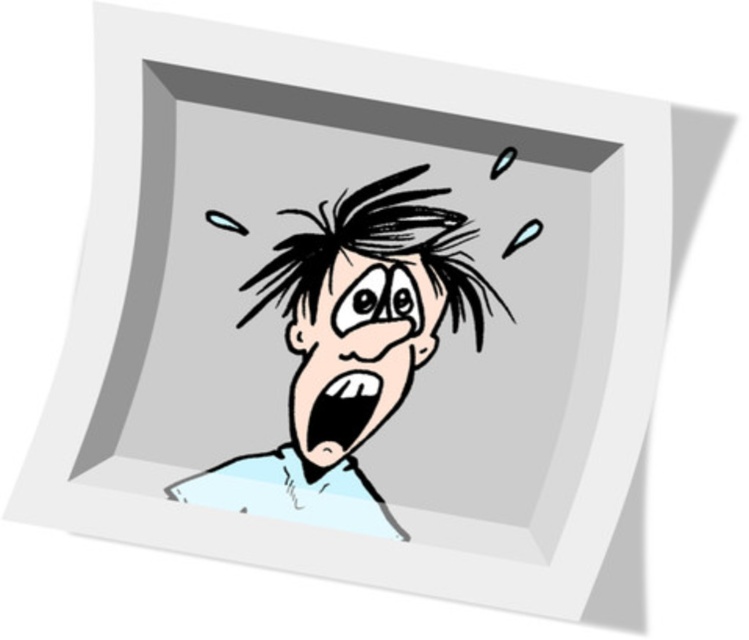
Based on the scene description, which object has a greater width between the black spiky hair at center and the black matte mouth at center?

The black spiky hair at center has a greater width than the black matte mouth at center according to the description.

What is the exact coordinate of the light blue paper at center?

The light blue paper at center is located at point (351, 342).

You are an artist trying to draw the scene described. You want to ensure that the light blue paper at center and the black matte mouth at center are positioned correctly. Based on the description, which object should appear in front of the other?

The light blue paper at center is closer to the viewer than the black matte mouth at center, so it should appear in front of the black matte mouth at center.